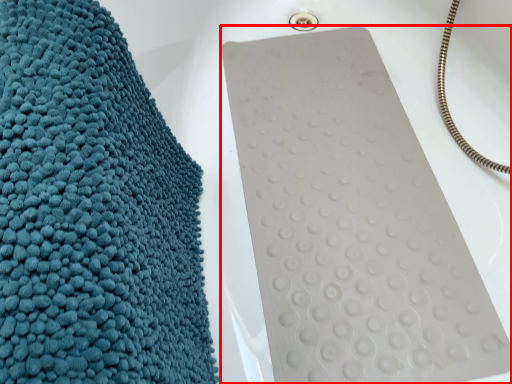
Question: From the image, what is the correct spatial relationship of bath towel (annotated by the red box) in relation to towel?

Choices:
 (A) left
 (B) right

Answer: (B)